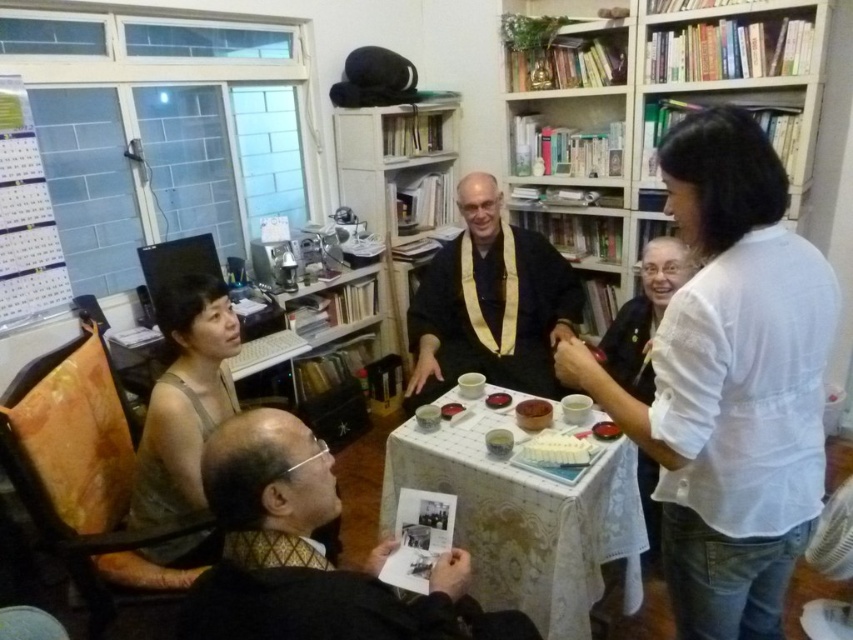
Question: Which point appears closest to the camera in this image?

Choices:
 (A) (537, 262)
 (B) (633, 340)

Answer: (B)

Question: Which of the following is the farthest from the observer?

Choices:
 (A) white lace tablecloth at center
 (B) white cotton blouse at upper right

Answer: (B)

Question: Considering the relative positions of white cotton blouse at upper right and white matte rectangular plate at center in the image provided, where is white cotton blouse at upper right located with respect to white matte rectangular plate at center?

Choices:
 (A) left
 (B) right

Answer: (B)

Question: Is white textured blouse at upper right smaller than white cotton blouse at upper right?

Choices:
 (A) yes
 (B) no

Answer: (B)

Question: Does white textured blouse at upper right have a larger size compared to black textured jacket at lower left?

Choices:
 (A) yes
 (B) no

Answer: (A)

Question: Which object appears farthest from the camera in this image?

Choices:
 (A) white cotton blouse at upper right
 (B) black textured jacket at lower left
 (C) white wooden bookshelf at upper right

Answer: (C)